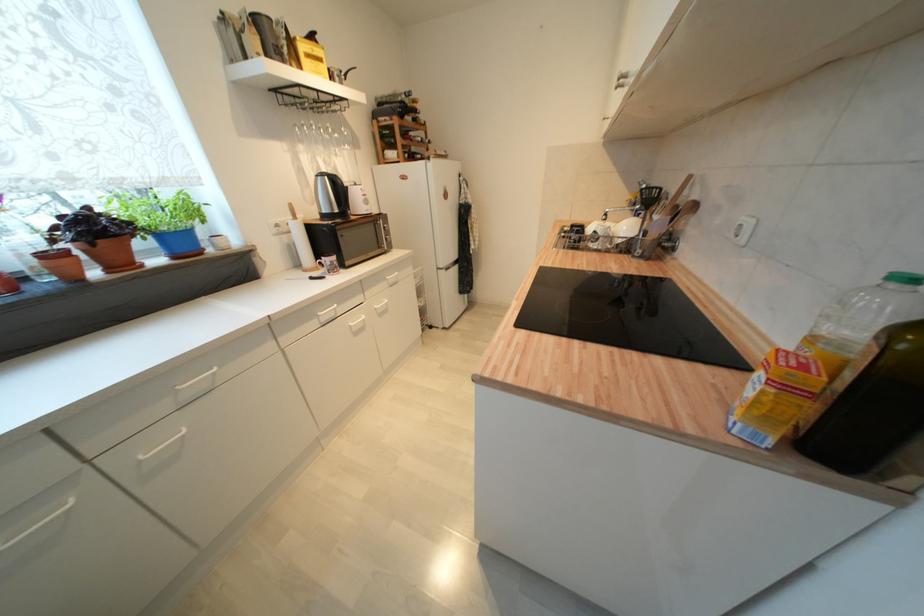
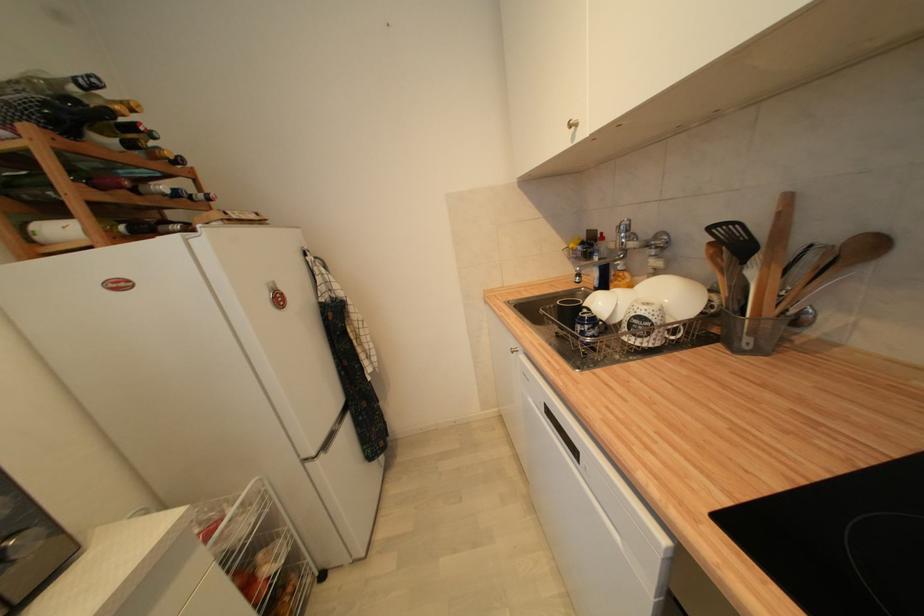
Find the pixel in the second image that matches point (434, 145) in the first image.

(213, 200)